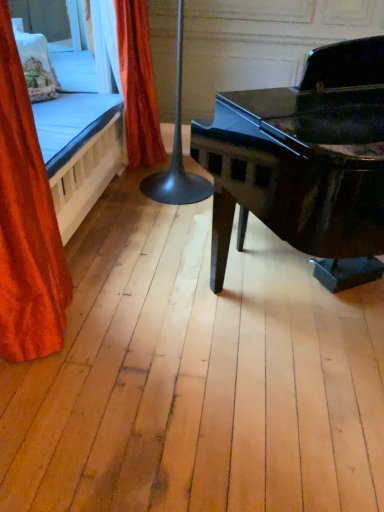
Identify the location of free point behind orange velvet curtain at left, the second curtain positioned from the back. (105, 276).